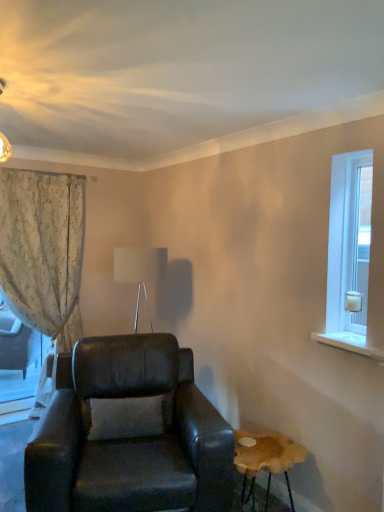
Locate an element on the screen. leather armchair at center is located at coordinates (129, 439).

Locate an element on the screen. wooden stool at lower right is located at coordinates (266, 459).

Measure the distance between point (60, 213) and camera.

Point (60, 213) is 12.05 feet from camera.

Locate an element on the screen. The width and height of the screenshot is (384, 512). white fabric lampshade at upper center is located at coordinates (140, 271).

Is floral fabric curtain at left at the right side of white fabric lampshade at upper center?

In fact, floral fabric curtain at left is to the left of white fabric lampshade at upper center.

Consider the image. From the image's perspective, who appears lower, floral fabric curtain at left or white fabric lampshade at upper center?

floral fabric curtain at left appears lower in the image.

Based on the photo, are floral fabric curtain at left and white fabric lampshade at upper center located far from each other?

floral fabric curtain at left is near white fabric lampshade at upper center, not far away.

How much distance is there between floral fabric curtain at left and white fabric lampshade at upper center?

floral fabric curtain at left is 32.65 inches away from white fabric lampshade at upper center.

Is wooden stool at lower right positioned with its back to leather armchair at center?

No, leather armchair at center is not at the back of wooden stool at lower right.

Is wooden stool at lower right to the left of leather armchair at center from the viewer's perspective?

No, wooden stool at lower right is not to the left of leather armchair at center.

Consider the image. Considering the sizes of objects wooden stool at lower right and leather armchair at center in the image provided, who is smaller, wooden stool at lower right or leather armchair at center?

Smaller between the two is wooden stool at lower right.

Is leather armchair at center facing towards clear glass door at right?

No, leather armchair at center is not facing towards clear glass door at right.

Is leather armchair at center completely or partially outside of clear glass door at right?

Absolutely, leather armchair at center is external to clear glass door at right.

The height and width of the screenshot is (512, 384). In order to click on glass door on the right of leather armchair at center in this screenshot , I will do `click(359, 240)`.

Is leather armchair at center positioned far away from clear glass door at right?

Yes.

Considering the relative positions of clear glass door at right and floral fabric curtain at left in the image provided, is clear glass door at right to the left or to the right of floral fabric curtain at left?

In the image, clear glass door at right appears on the right side of floral fabric curtain at left.

Which of these two, clear glass door at right or floral fabric curtain at left, is thinner?

clear glass door at right.

Considering the relative positions of clear glass door at right and floral fabric curtain at left in the image provided, is clear glass door at right in front of floral fabric curtain at left?

Yes, it is.

Is clear glass door at right with floral fabric curtain at left?

No, clear glass door at right is not next to floral fabric curtain at left.

Is wooden stool at lower right next to floral fabric curtain at left and touching it?

wooden stool at lower right and floral fabric curtain at left are clearly separated.

This screenshot has width=384, height=512. Identify the location of curtain behind the wooden stool at lower right. (43, 250).

In the image, is wooden stool at lower right on the left side or the right side of floral fabric curtain at left?

In the image, wooden stool at lower right appears on the right side of floral fabric curtain at left.

Does wooden stool at lower right lie behind floral fabric curtain at left?

No.

Is clear glass door at right a part of white fabric lampshade at upper center?

No, clear glass door at right is not surrounded by white fabric lampshade at upper center.

From the image's perspective, which is above, white fabric lampshade at upper center or clear glass door at right?

clear glass door at right is shown above in the image.

How different are the orientations of white fabric lampshade at upper center and clear glass door at right in degrees?

52 degrees separate the facing orientations of white fabric lampshade at upper center and clear glass door at right.

From a real-world perspective, which object rests below the other?

white fabric lampshade at upper center is physically lower.

Consider the image. Would you say white fabric lampshade at upper center is a long distance from wooden stool at lower right?

That's right, there is a large distance between white fabric lampshade at upper center and wooden stool at lower right.

The image size is (384, 512). I want to click on table below the white fabric lampshade at upper center (from the image's perspective), so click(266, 459).

What's the angular difference between white fabric lampshade at upper center and wooden stool at lower right's facing directions?

25.3 degrees separate the facing orientations of white fabric lampshade at upper center and wooden stool at lower right.

Locate an element on the screen. curtain that is on the left side of white fabric lampshade at upper center is located at coordinates (43, 250).

In order to click on table that appears on the right of leather armchair at center in this screenshot , I will do `click(266, 459)`.

Estimate the real-world distances between objects in this image. Which object is closer to leather armchair at center, clear glass door at right or floral fabric curtain at left?

The object closer to leather armchair at center is floral fabric curtain at left.

From the image, which object appears to be nearer to clear glass door at right, white fabric lampshade at upper center or wooden stool at lower right?

wooden stool at lower right is positioned closer to the anchor clear glass door at right.

Looking at the image, which one is located further to clear glass door at right, leather armchair at center or white fabric lampshade at upper center?

Among the two, white fabric lampshade at upper center is located further to clear glass door at right.

From the image, which object appears to be farther from wooden stool at lower right, white fabric lampshade at upper center or leather armchair at center?

Based on the image, white fabric lampshade at upper center appears to be further to wooden stool at lower right.

When comparing their distances from wooden stool at lower right, does clear glass door at right or leather armchair at center seem closer?

leather armchair at center.

Looking at the image, which one is located further to wooden stool at lower right, floral fabric curtain at left or clear glass door at right?

Based on the image, floral fabric curtain at left appears to be further to wooden stool at lower right.

Estimate the real-world distances between objects in this image. Which object is further from clear glass door at right, white fabric lampshade at upper center or leather armchair at center?

white fabric lampshade at upper center is positioned further to the anchor clear glass door at right.

Considering their positions, is wooden stool at lower right positioned further to leather armchair at center than floral fabric curtain at left?

floral fabric curtain at left is positioned further to the anchor leather armchair at center.

I want to click on chair between floral fabric curtain at left and clear glass door at right, so click(x=129, y=439).

This screenshot has height=512, width=384. Identify the location of lamp between leather armchair at center and floral fabric curtain at left from front to back. (140, 271).

You are a GUI agent. You are given a task and a screenshot of the screen. Output one action in this format:
    pyautogui.click(x=<x>, y=<y>)
    Task: Click on the chair located between floral fabric curtain at left and wooden stool at lower right in the left-right direction
    
    Given the screenshot: What is the action you would take?
    pyautogui.click(x=129, y=439)

Find the location of `chair situated between white fabric lampshade at upper center and clear glass door at right from left to right`. chair situated between white fabric lampshade at upper center and clear glass door at right from left to right is located at coordinates (129, 439).